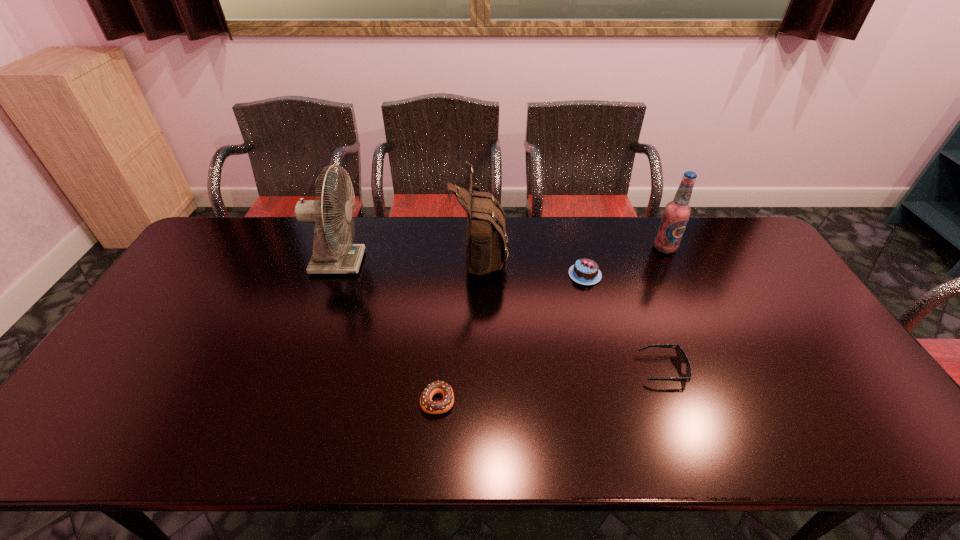
Where is `the leftmost object`? The image size is (960, 540). the leftmost object is located at coordinates (x=329, y=257).

Identify the location of shoulder bag. (486, 244).

At what (x,y) coordinates should I click in order to perform the action: click on alcohol. Please return your answer as a coordinate pair (x, y). Looking at the image, I should click on (676, 214).

Locate an element on the screen. the fourth shortest object is located at coordinates (676, 214).

Find the location of a particular element. The image size is (960, 540). chocolate cake is located at coordinates (585, 271).

At what (x,y) coordinates should I click in order to perform the action: click on the fourth tallest object. Please return your answer as a coordinate pair (x, y). Looking at the image, I should click on (585, 271).

Locate an element on the screen. The height and width of the screenshot is (540, 960). sunglasses is located at coordinates (680, 353).

I want to click on doughnut, so click(x=431, y=407).

Find the location of `vacant space positioned 0.290m on the front-facing side of the leftmost object`. vacant space positioned 0.290m on the front-facing side of the leftmost object is located at coordinates (451, 262).

Locate an element on the screen. Image resolution: width=960 pixels, height=540 pixels. vacant space located on the front-facing side of the shoulder bag is located at coordinates (528, 252).